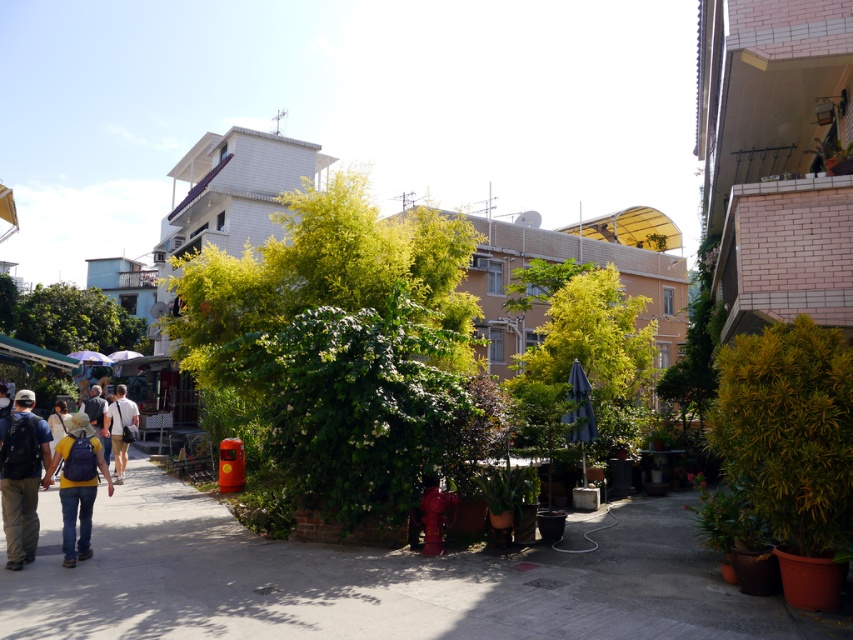
Question: Estimate the real-world distances between objects in this image. Which object is closer to the light brown backpack at center-left?

Choices:
 (A) denim jeans at lower left
 (B) denim jacket at lower left
 (C) gray concrete pavement at center

Answer: (B)

Question: From the image, what is the correct spatial relationship of green leafy tree at center in relation to denim jacket at lower left?

Choices:
 (A) above
 (B) below

Answer: (A)

Question: In this image, where is gray concrete pavement at center located relative to denim jacket at lower left?

Choices:
 (A) left
 (B) right

Answer: (B)

Question: Is blue fabric umbrella at center thinner than light brown backpack at center?

Choices:
 (A) no
 (B) yes

Answer: (A)

Question: Estimate the real-world distances between objects in this image. Which object is farther from the denim jacket at lower left?

Choices:
 (A) denim jeans at lower left
 (B) gray concrete pavement at center
 (C) light brown backpack at center-left
 (D) light brown backpack at center

Answer: (B)

Question: Which of the following is the farthest from the observer?

Choices:
 (A) denim jeans at lower left
 (B) blue fabric umbrella at center
 (C) light brown backpack at center

Answer: (C)